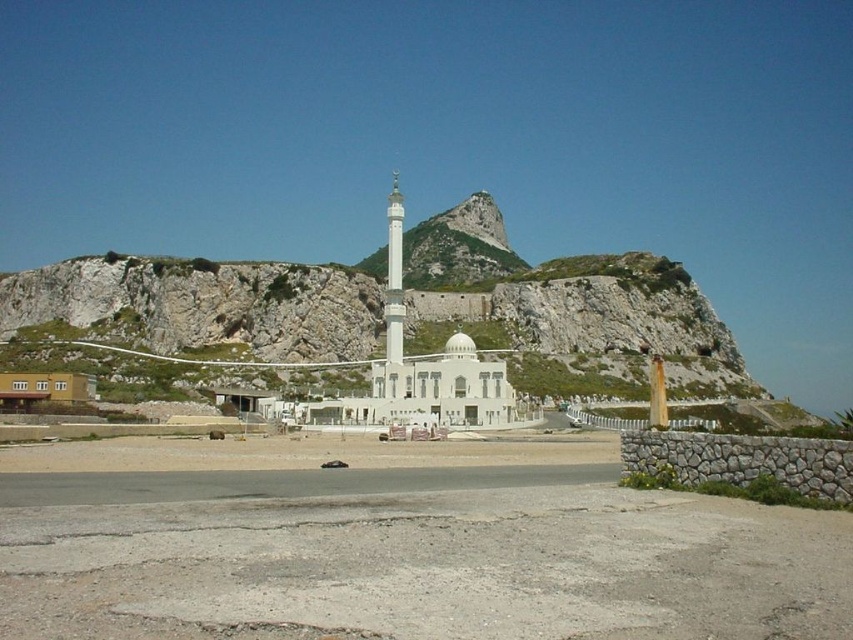
Question: Which point appears closest to the camera in this image?

Choices:
 (A) (726, 436)
 (B) (392, 234)

Answer: (A)

Question: Can you confirm if gray stone wall at lower right is smaller than white marble minaret at center?

Choices:
 (A) no
 (B) yes

Answer: (B)

Question: Among these objects, which one is farthest from the camera?

Choices:
 (A) gray stone wall at lower right
 (B) white marble minaret at center

Answer: (B)

Question: Does gray stone wall at lower right appear on the right side of white marble minaret at center?

Choices:
 (A) no
 (B) yes

Answer: (B)

Question: Among these objects, which one is farthest from the camera?

Choices:
 (A) white marble minaret at center
 (B) gray stone wall at lower right

Answer: (A)

Question: From the image, what is the correct spatial relationship of gray stone wall at lower right in relation to white marble minaret at center?

Choices:
 (A) right
 (B) left

Answer: (A)